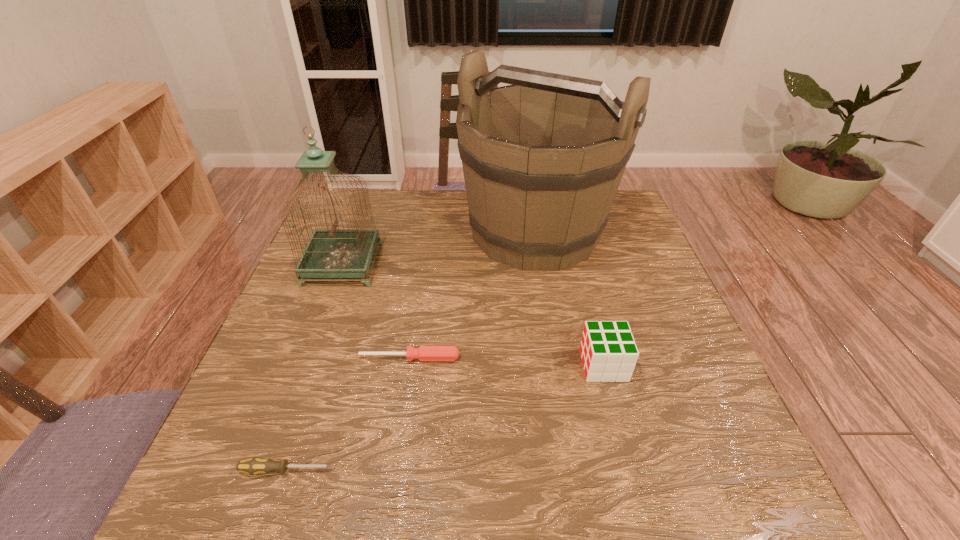
What are the coordinates of `bucket` in the screenshot? It's located at (543, 158).

Where is `the second tallest object`? This screenshot has height=540, width=960. the second tallest object is located at coordinates (330, 253).

Find the location of `cube`. cube is located at coordinates (608, 350).

This screenshot has width=960, height=540. I want to click on the farther screwdriver, so click(x=424, y=353).

Find the location of `the nearer screwdriver`. the nearer screwdriver is located at coordinates (253, 466).

I want to click on vacant space positioned 0.100m on the left of the tallest object, so click(x=427, y=232).

You are a GUI agent. You are given a task and a screenshot of the screen. Output one action in this format:
    pyautogui.click(x=<x>, y=<y>)
    Task: Click on the vacant area located at the door of the birdcage
    
    Given the screenshot: What is the action you would take?
    pyautogui.click(x=396, y=264)

Find the location of a particular element. This screenshot has height=540, width=960. free space located on the red face of the cube is located at coordinates (446, 365).

Locate an element on the screen. Image resolution: width=960 pixels, height=540 pixels. vacant space situated 0.400m on the red face of the cube is located at coordinates (395, 365).

The height and width of the screenshot is (540, 960). Find the location of `vacant space situated 0.280m on the red face of the cube`. vacant space situated 0.280m on the red face of the cube is located at coordinates (451, 365).